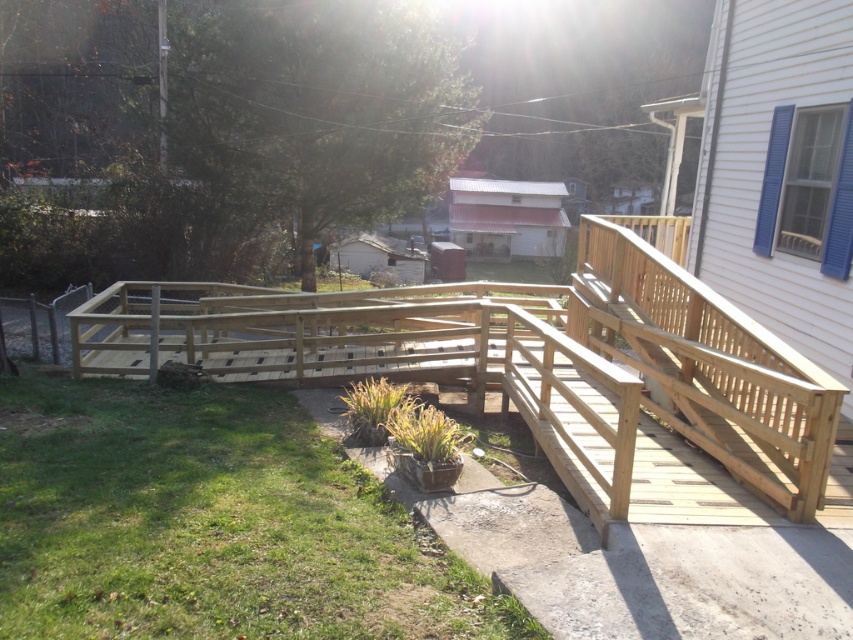
You are standing at the edge of the residential backyard and want to place a new bench on the natural wood porch at center. According to the coordinates provided, is the porch positioned closer to the front or the back of the backyard?

The natural wood porch at center is located at coordinates point (537, 371). Since the y coordinate is 0.631, which is closer to 1.0, the porch is positioned closer to the back of the backyard.

You are standing on the concrete edge near the deck. You see a point marked at coordinates (537,371). Is this point located on the natural wood porch at center or on the grassy area?

The point marked at coordinates (537,371) is located on the natural wood porch at center.

You are standing 3 meters away from the natural wood porch at center. Can you reach it without moving closer?

The natural wood porch at center and viewer are 4.10 meters apart, so you are still 1.10 meters away and cannot reach it without moving closer.